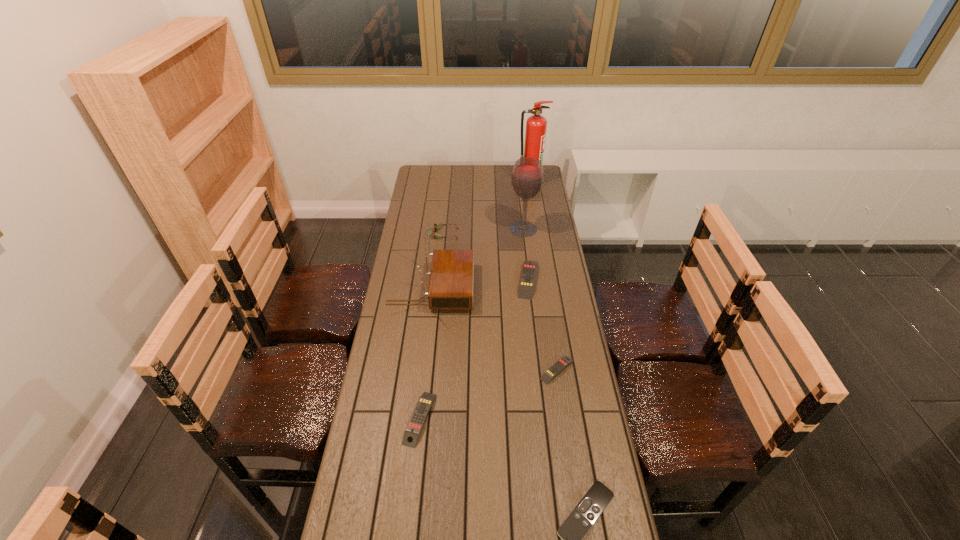
This screenshot has width=960, height=540. In order to click on radio_receiver that is at the left edge in this screenshot , I will do `click(450, 287)`.

You are a GUI agent. You are given a task and a screenshot of the screen. Output one action in this format:
    pyautogui.click(x=<x>, y=<y>)
    Task: Click on the spectacles that is at the left edge
    The image size is (960, 540).
    Given the screenshot: What is the action you would take?
    pyautogui.click(x=436, y=226)

This screenshot has height=540, width=960. I want to click on remote control that is at the left edge, so [x=424, y=404].

Locate an element on the screen. fire extinguisher that is at the right edge is located at coordinates (536, 125).

This screenshot has width=960, height=540. I want to click on alcohol located at the right edge, so click(x=527, y=178).

Find the location of a particular element. The image size is (960, 540). object positioned at the far right corner is located at coordinates (536, 125).

Where is `vacant space at the far edge`? Image resolution: width=960 pixels, height=540 pixels. vacant space at the far edge is located at coordinates (465, 187).

You are a GUI agent. You are given a task and a screenshot of the screen. Output one action in this format:
    pyautogui.click(x=<x>, y=<y>)
    Task: Click on the free point at the left edge
    Image resolution: width=960 pixels, height=540 pixels.
    Given the screenshot: What is the action you would take?
    pyautogui.click(x=378, y=353)

You are a GUI agent. You are given a task and a screenshot of the screen. Output one action in this format:
    pyautogui.click(x=<x>, y=<y>)
    Task: Click on the free space at the right edge of the desktop
    
    Given the screenshot: What is the action you would take?
    pyautogui.click(x=555, y=222)

Where is `vacant space at the far right corner of the desktop`? The image size is (960, 540). vacant space at the far right corner of the desktop is located at coordinates (543, 184).